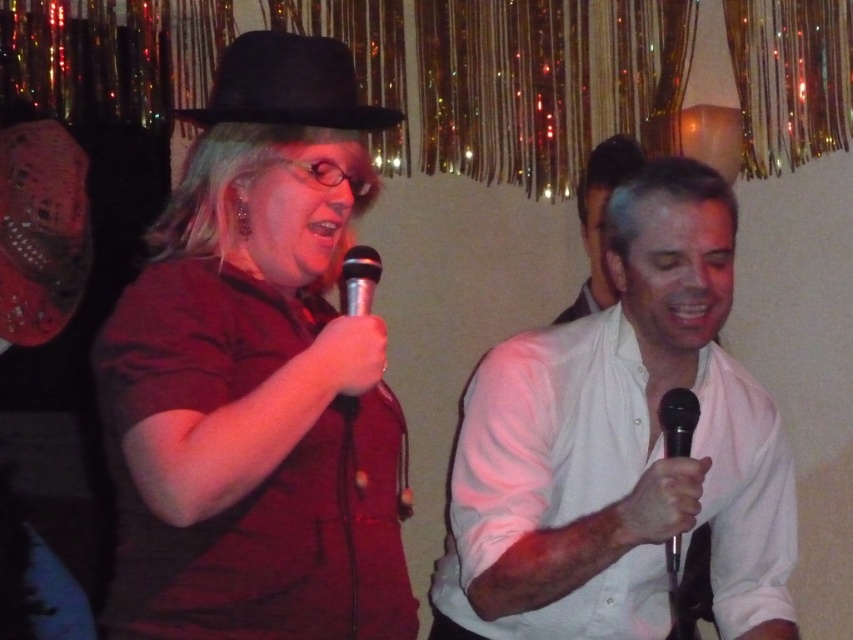
Question: Considering the relative positions of black felt fedora at upper left and black metallic microphone at center in the image provided, where is black felt fedora at upper left located with respect to black metallic microphone at center?

Choices:
 (A) below
 (B) above

Answer: (B)

Question: Which point appears closest to the camera in this image?

Choices:
 (A) [x=338, y=108]
 (B) [x=669, y=541]

Answer: (A)

Question: Which of the following is the closest to the observer?

Choices:
 (A) (660, 243)
 (B) (357, 257)
 (C) (364, 275)
 (D) (635, 148)

Answer: (C)

Question: Can you confirm if black felt fedora at upper left is positioned above black metallic microphone at right?

Choices:
 (A) no
 (B) yes

Answer: (B)

Question: In this image, where is white glossy shirt at right located relative to black metallic microphone at upper center?

Choices:
 (A) right
 (B) left

Answer: (A)

Question: Which of the following is the closest to the observer?

Choices:
 (A) black felt fedora at upper left
 (B) white glossy shirt at right
 (C) black metallic microphone at right
 (D) matte black hat at left

Answer: (D)